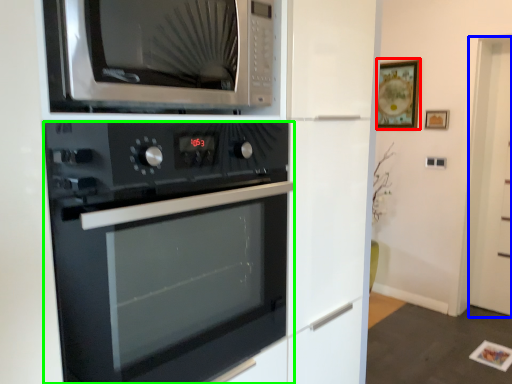
Question: Estimate the real-world distances between objects in this image. Which object is closer to picture frame (highlighted by a red box), glass door (highlighted by a blue box) or oven (highlighted by a green box)?

Choices:
 (A) glass door
 (B) oven

Answer: (A)